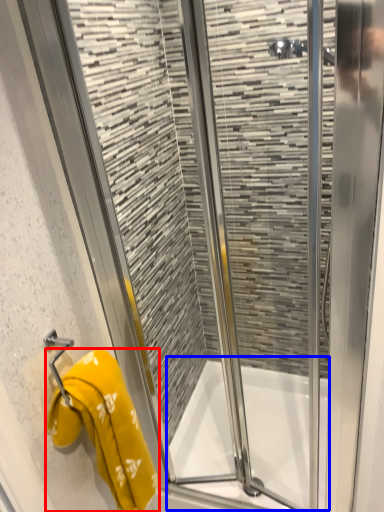
Question: Which of the following is the farthest to the observer, towel (highlighted by a red box) or bath (highlighted by a blue box)?

Choices:
 (A) towel
 (B) bath

Answer: (B)